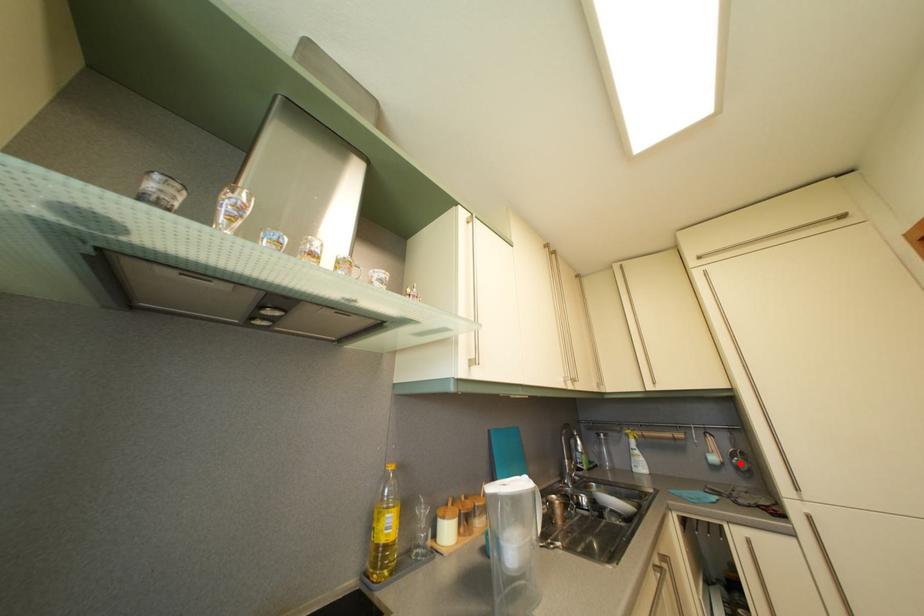
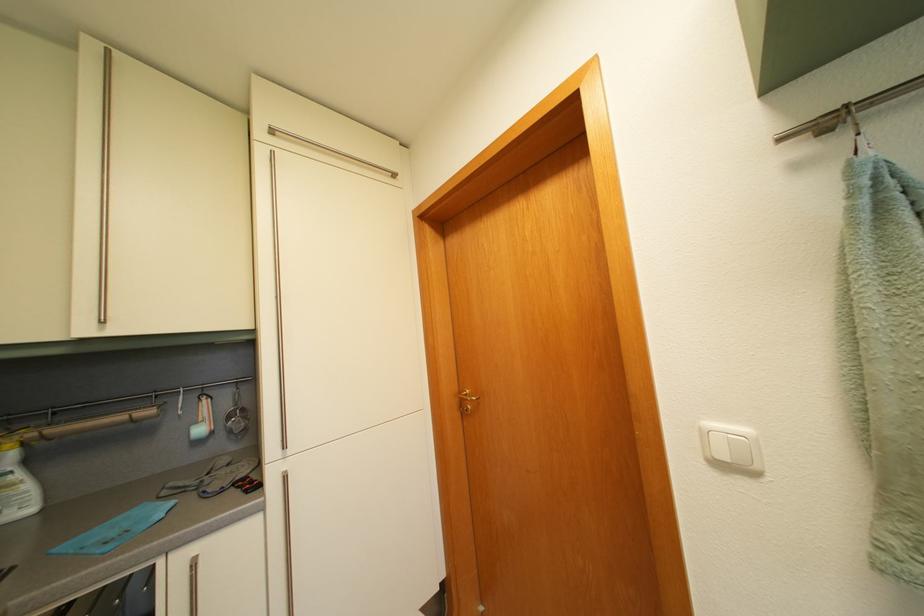
Find the pixel in the second image that matches the highlighted location in the first image.

(237, 424)